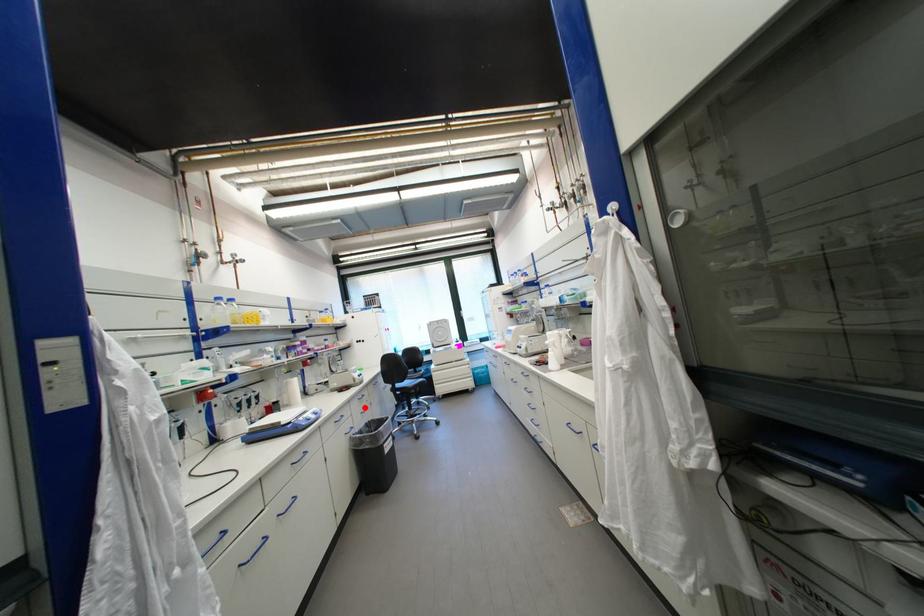
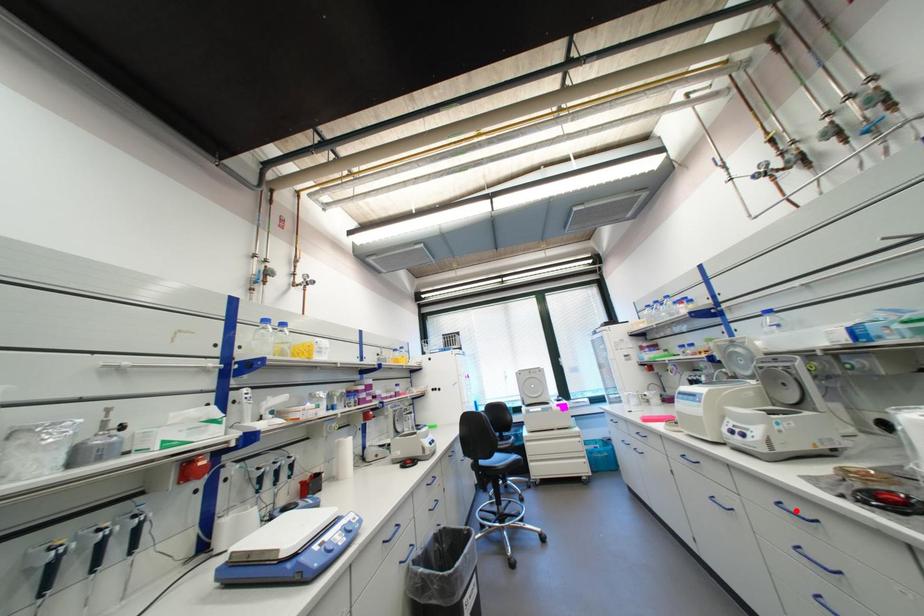
I am providing you with two images of the same scene from different viewpoints. A red point is marked on the first image and another point is marked on the second image. Does the point marked in image1 correspond to the same location as the one in image2?

No